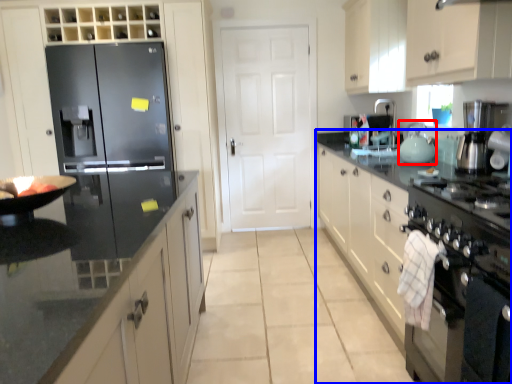
Question: Which of the following is the closest to the observer, tea pot (highlighted by a red box) or cabinetry (highlighted by a blue box)?

Choices:
 (A) tea pot
 (B) cabinetry

Answer: (B)